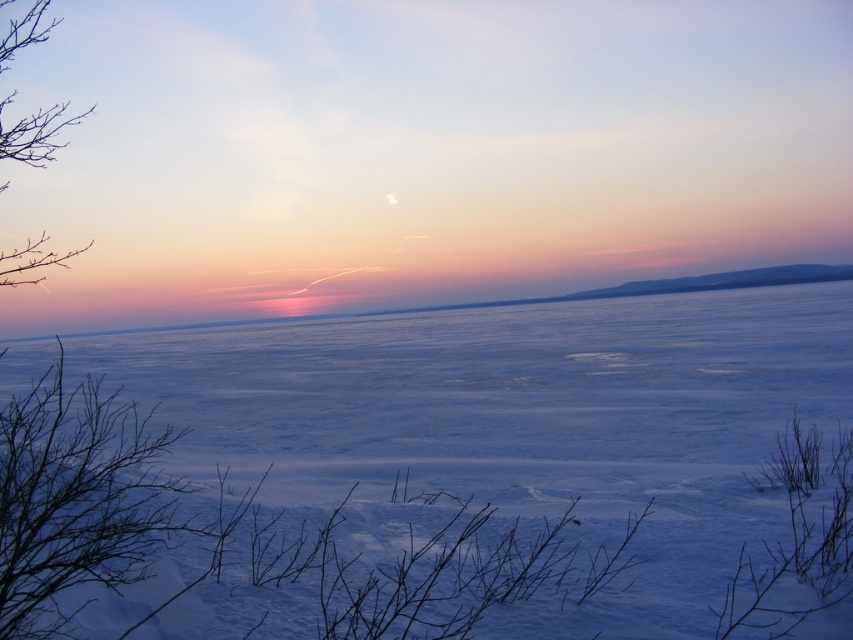
Can you confirm if white ice at center is positioned above bare branches at left?

No, white ice at center is not above bare branches at left.

Between white ice at center and bare branches at left, which one has more height?

Standing taller between the two is bare branches at left.

Is point (653, 413) farther from camera compared to point (22, 278)?

Yes, it is behind point (22, 278).

You are a GUI agent. You are given a task and a screenshot of the screen. Output one action in this format:
    pyautogui.click(x=<x>, y=<y>)
    Task: Click on the white ice at center
    
    Given the screenshot: What is the action you would take?
    pyautogui.click(x=508, y=388)